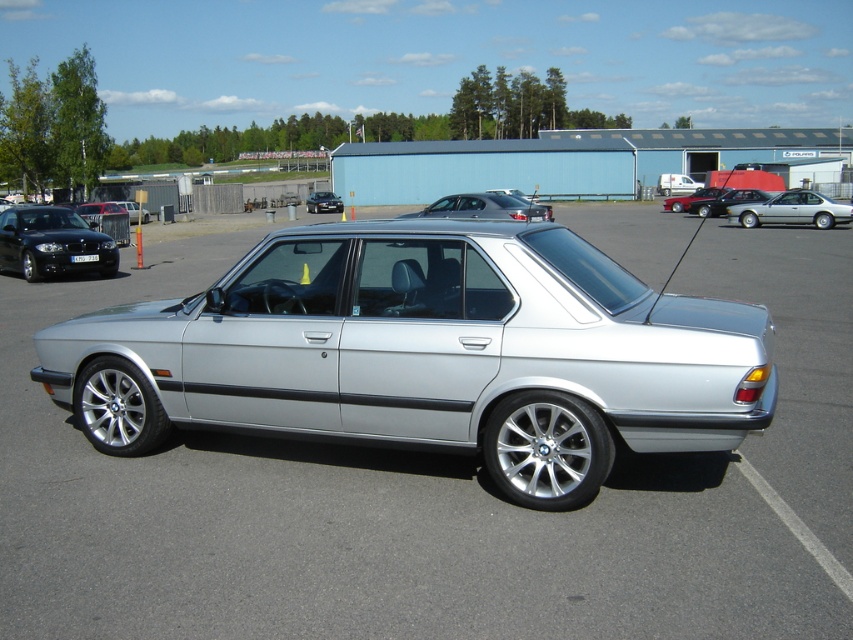
Question: Among these objects, which one is nearest to the camera?

Choices:
 (A) matte black sedan at left
 (B) white plastic license plate at center
 (C) satin silver sedan at right

Answer: (B)

Question: Which of the following is the farthest from the observer?

Choices:
 (A) white plastic license plate at center
 (B) silver metallic car at center
 (C) satin silver sedan at right
 (D) shiny black sedan at left

Answer: (C)

Question: Which point appears farthest from the camera in this image?

Choices:
 (A) (318, 195)
 (B) (717, 205)

Answer: (A)

Question: Can you confirm if shiny red car at center is wider than white plastic license plate at center?

Choices:
 (A) no
 (B) yes

Answer: (B)

Question: Is shiny black sedan at left to the right of silver metallic sedan at right from the viewer's perspective?

Choices:
 (A) yes
 (B) no

Answer: (B)

Question: Can you confirm if satin black sedan at center is smaller than shiny black sedan at center?

Choices:
 (A) yes
 (B) no

Answer: (B)